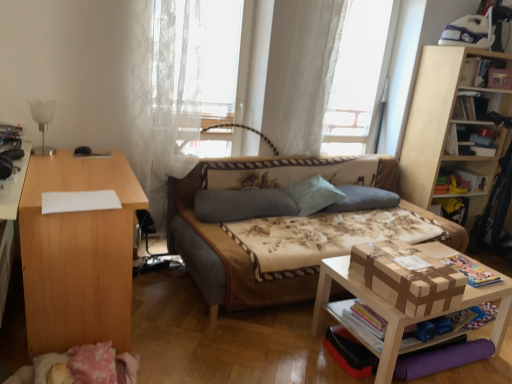
At what (x,y) coordinates should I click in order to perform the action: click on vacant space to the right of white glass lamp at left. Please return your answer as a coordinate pair (x, y). Image resolution: width=512 pixels, height=384 pixels. Looking at the image, I should click on (72, 157).